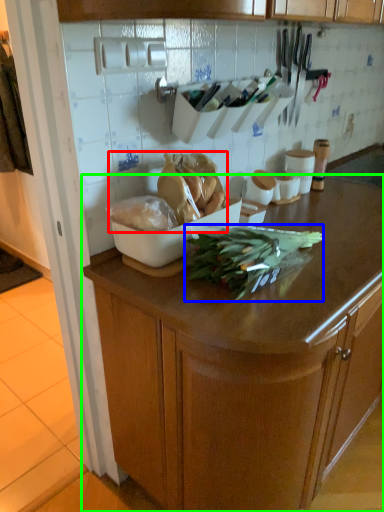
Question: Which object is positioned closest to food (highlighted by a red box)? Select from green vegetables (highlighted by a blue box) and cabinetry (highlighted by a green box).

Choices:
 (A) green vegetables
 (B) cabinetry

Answer: (A)